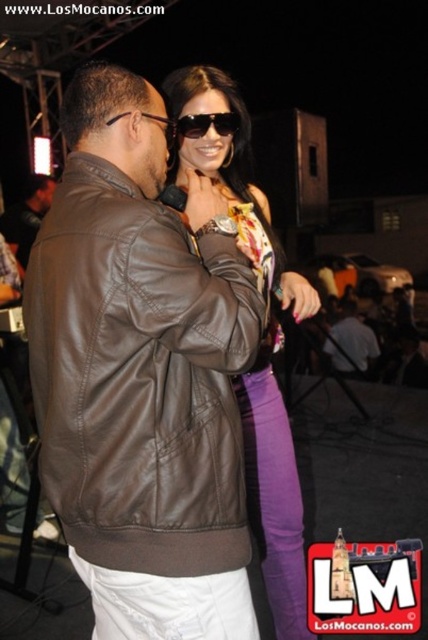
Question: Can you confirm if brown leather jacket at center is wider than black plastic sunglasses at upper center?

Choices:
 (A) yes
 (B) no

Answer: (A)

Question: Is the position of shiny purple jeans at center more distant than that of brown leather jacket at center?

Choices:
 (A) no
 (B) yes

Answer: (A)

Question: Estimate the real-world distances between objects in this image. Which object is farther from the brown leather jacket at center?

Choices:
 (A) shiny purple jeans at center
 (B) brown leather jacket at left

Answer: (B)

Question: Which of the following is the farthest from the observer?

Choices:
 (A) (306, 636)
 (B) (231, 124)

Answer: (A)

Question: Which of these objects is positioned closest to the shiny purple jeans at center?

Choices:
 (A) brown leather jacket at left
 (B) black plastic sunglasses at upper center
 (C) brown leather jacket at center
 (D) dark brown leather jacket at center

Answer: (A)

Question: Can you confirm if brown leather jacket at left is positioned below black plastic sunglasses at upper center?

Choices:
 (A) no
 (B) yes

Answer: (B)